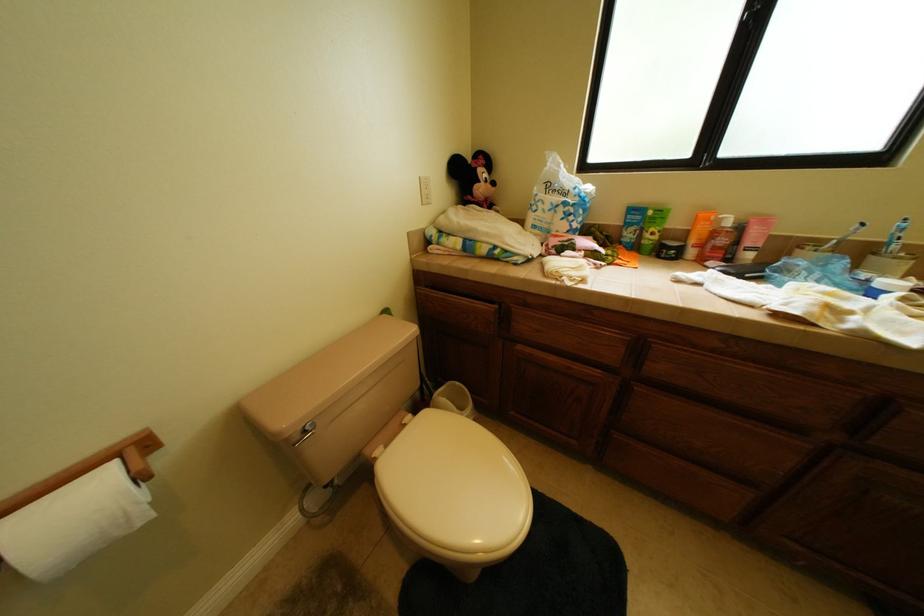
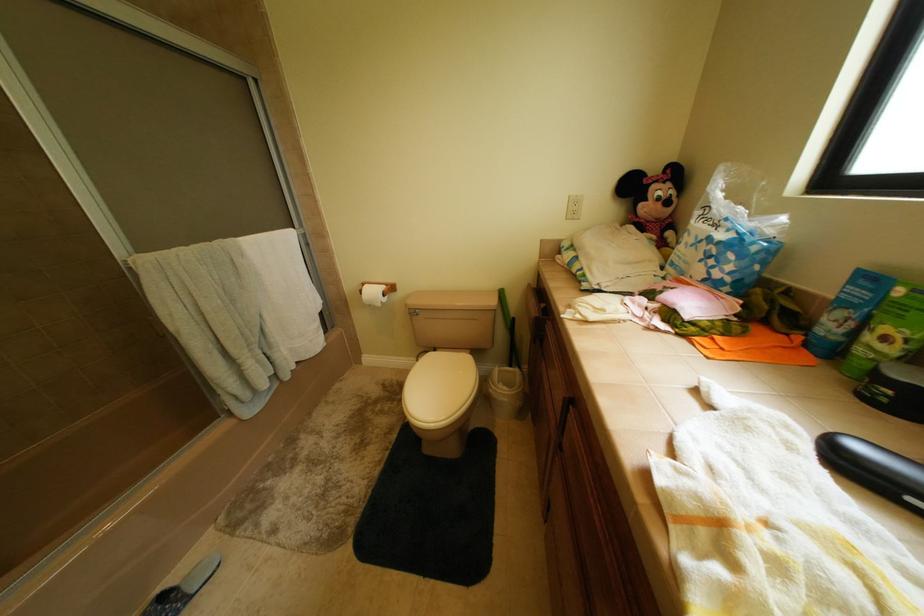
Question: The camera is either moving clockwise (left) or counter-clockwise (right) around the object. The first image is from the beginning of the video and the second image is from the end. Is the camera moving left or right when shooting the video?

Choices:
 (A) Left
 (B) Right

Answer: (B)